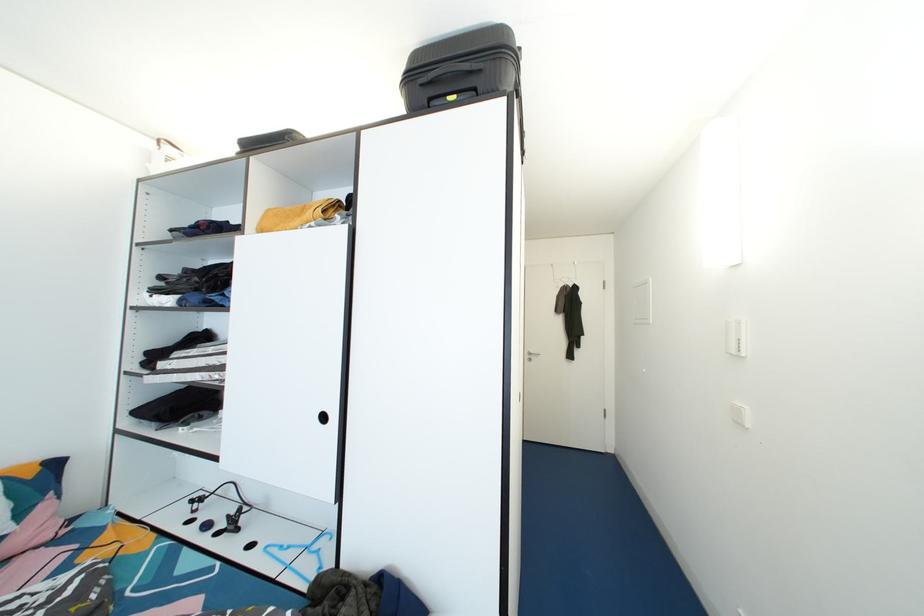
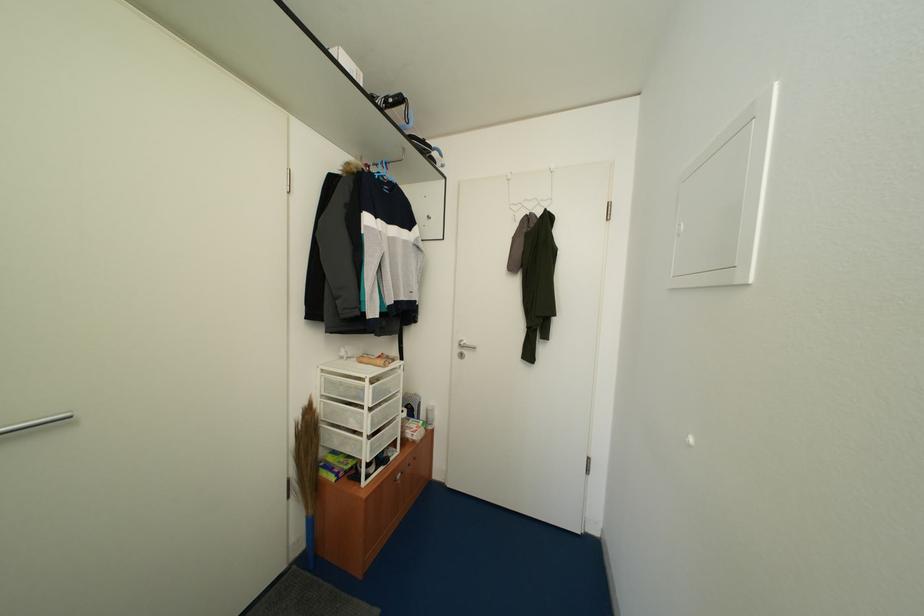
Which direction would the cameraman need to move to produce the second image?

The cameraman walked toward right, forward.